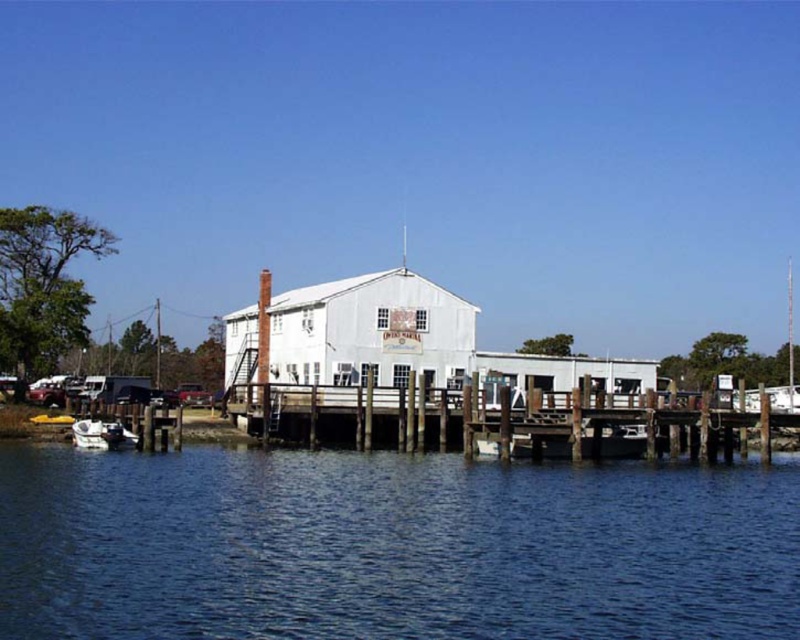
Can you confirm if blue liquid water at lower center is wider than white matte boat at lower left?

Yes.

Between point (368, 570) and point (85, 420), which one is positioned behind?

The point (85, 420) is behind.

Who is more forward, (754, 499) or (88, 444)?

Point (754, 499)

I want to click on blue liquid water at lower center, so click(390, 547).

Who is positioned more to the right, wooden at center or white matte boat at lower left?

From the viewer's perspective, wooden at center appears more on the right side.

The image size is (800, 640). What do you see at coordinates (496, 420) in the screenshot?
I see `wooden at center` at bounding box center [496, 420].

The image size is (800, 640). What are the coordinates of `wooden at center` in the screenshot? It's located at (496, 420).

Can you confirm if blue liquid water at lower center is wider than metallic red car at lower left?

Yes, blue liquid water at lower center is wider than metallic red car at lower left.

From the picture: Is blue liquid water at lower center smaller than metallic red car at lower left?

No, blue liquid water at lower center is not smaller than metallic red car at lower left.

Is point (132, 563) behind point (192, 387)?

No, it is in front of (192, 387).

This screenshot has height=640, width=800. I want to click on blue liquid water at lower center, so click(x=390, y=547).